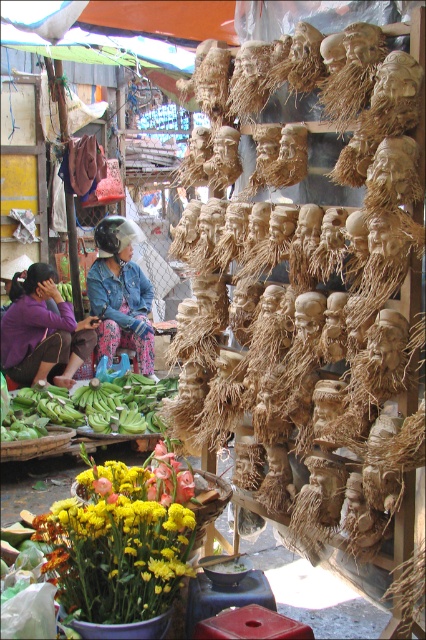
Looking at this image, you are a customer at the market and see the purple fabric at lower left and the denim jacket at center. Which item is positioned lower in the image?

The purple fabric at lower left is located below the denim jacket at center, so it is positioned lower in the image.

You are a customer at the market and want to pick up the purple fabric at lower left and the denim jacket at center. Which item should you reach for first to avoid obstructing your view of the other?

You should reach for the purple fabric at lower left first because it is closer to you, allowing you to pick it up without blocking your view of the denim jacket at center which is further away.